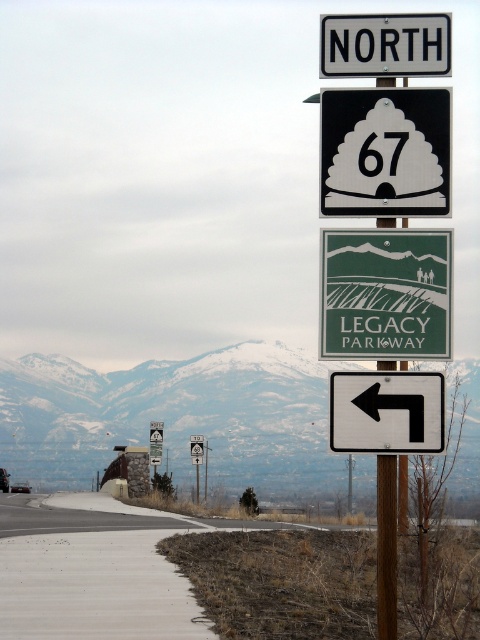
Question: Is the position of snowy mountain at upper center more distant than that of green matte sign at center?

Choices:
 (A) no
 (B) yes

Answer: (A)

Question: Can you confirm if snowy mountain at upper center is wider than green matte sign at center?

Choices:
 (A) no
 (B) yes

Answer: (B)

Question: Does green matte sign at center have a greater width compared to white plastic arrow at left?

Choices:
 (A) yes
 (B) no

Answer: (A)

Question: Which object is positioned closest to the white plastic arrow at left?

Choices:
 (A) white plastic road sign at upper center
 (B) green matte sign at center

Answer: (B)

Question: Which of these objects is positioned farthest from the white plastic sign at upper center?

Choices:
 (A) white plastic arrow at left
 (B) white plastic road sign at upper center

Answer: (A)

Question: Among these points, which one is farthest from the camera?

Choices:
 (A) (397, 410)
 (B) (192, 432)
 (C) (407, 102)

Answer: (B)